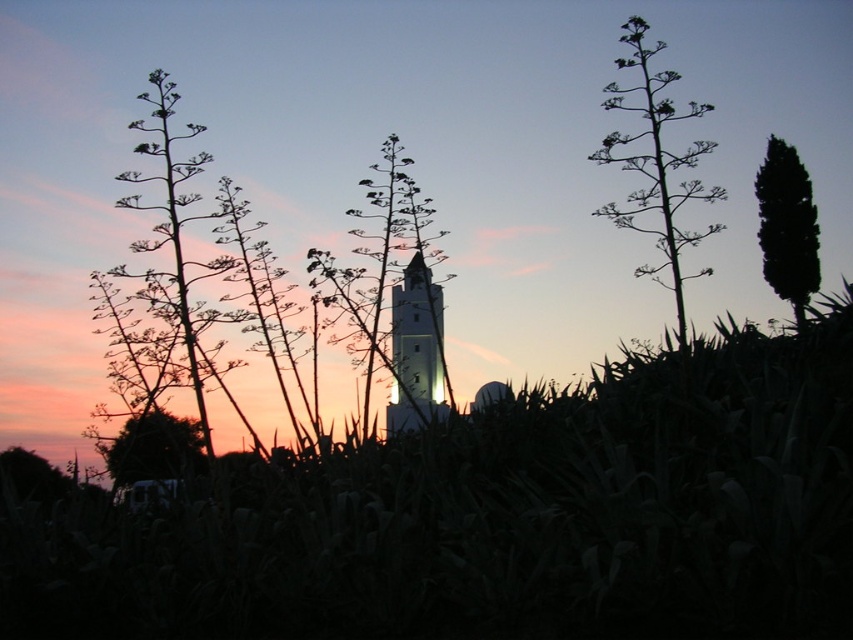
Can you confirm if silhouette leafy plant at left is thinner than green leafy plant at upper right?

No, silhouette leafy plant at left is not thinner than green leafy plant at upper right.

Looking at this image, is silhouette leafy plant at left below green leafy plant at upper right?

Yes, silhouette leafy plant at left is below green leafy plant at upper right.

At what (x,y) coordinates should I click in order to perform the action: click on silhouette leafy plant at left. Please return your answer as a coordinate pair (x, y). Looking at the image, I should click on (163, 275).

Does silhouette leafy plant at left have a greater width compared to white smooth tower at center?

Yes, silhouette leafy plant at left is wider than white smooth tower at center.

Between point (142, 182) and point (434, 312), which one is positioned in front?

Positioned in front is point (142, 182).

At what (x,y) coordinates should I click in order to perform the action: click on silhouette leafy plant at left. Please return your answer as a coordinate pair (x, y). The image size is (853, 640). Looking at the image, I should click on (163, 275).

Based on the photo, which is more to the right, green leafy plant at center or silhouette leafy plant at left?

From the viewer's perspective, green leafy plant at center appears more on the right side.

Who is more distant from viewer, (416, 216) or (202, 387)?

The point (416, 216) is more distant.

I want to click on green leafy plant at center, so click(392, 291).

Locate an element on the screen. The height and width of the screenshot is (640, 853). green leafy plant at center is located at coordinates (392, 291).